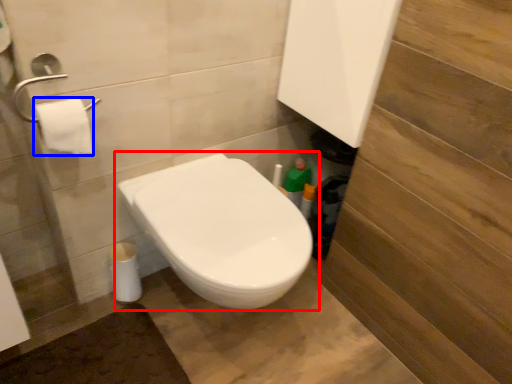
Question: Which object appears farthest to the camera in this image, toilet (highlighted by a red box) or toilet paper (highlighted by a blue box)?

Choices:
 (A) toilet
 (B) toilet paper

Answer: (B)